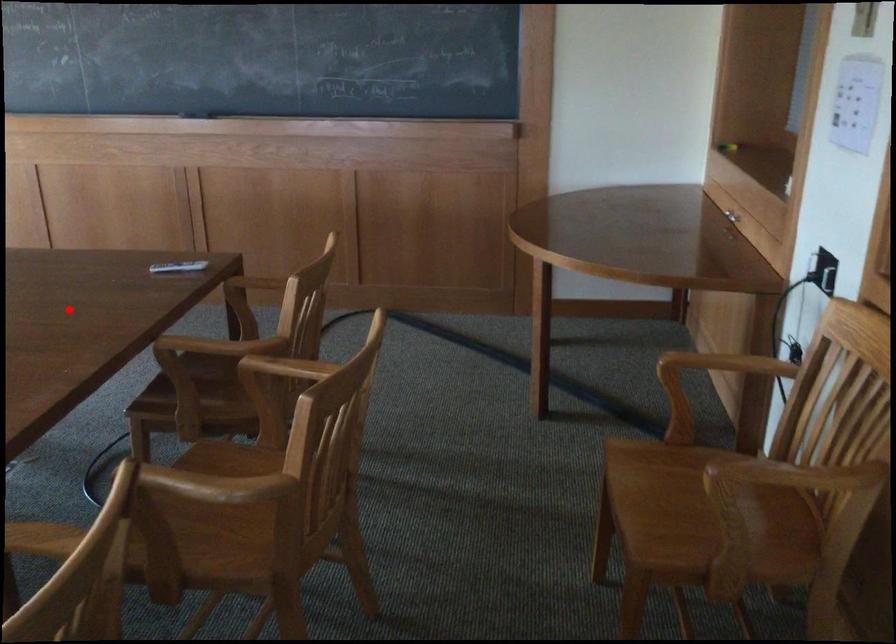
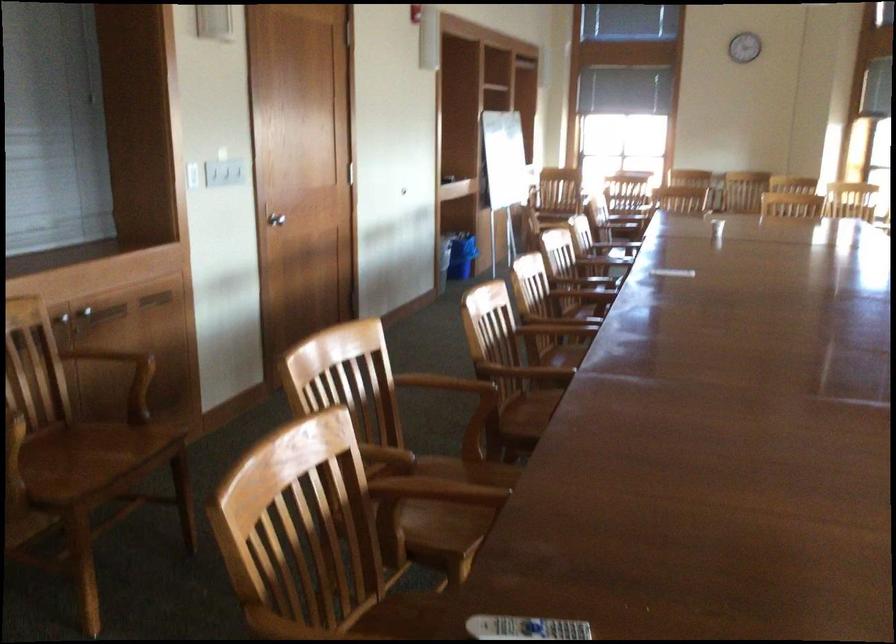
Where in the second image is the point corresponding to the highlighted location from the first image?

(524, 628)